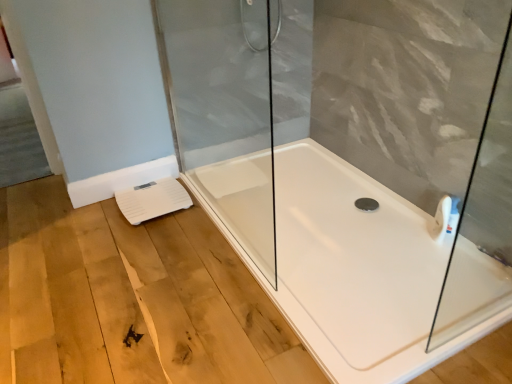
I want to click on vacant space to the right of transparent glass shower door at center, so click(323, 220).